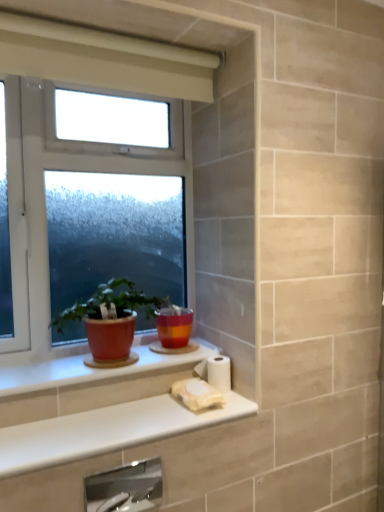
Identify the location of free space in front of white matte toilet paper at lower center, which is the second toilet paper from bottom to top. Image resolution: width=384 pixels, height=512 pixels. (208, 413).